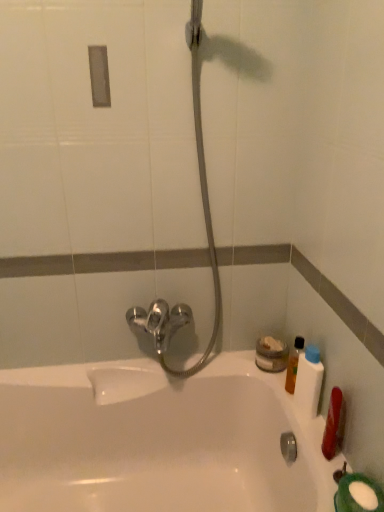
Question: Considering the relative sizes of translucent plastic bottle at right, which appears as the 1th mouthwash when viewed from the back, and white glossy bathtub at center in the image provided, is translucent plastic bottle at right, which appears as the 1th mouthwash when viewed from the back, taller than white glossy bathtub at center?

Choices:
 (A) no
 (B) yes

Answer: (A)

Question: From the image's perspective, is translucent plastic bottle at right, marked as the 2th mouthwash in a front-to-back arrangement, located beneath white glossy bathtub at center?

Choices:
 (A) no
 (B) yes

Answer: (A)

Question: From a real-world perspective, is translucent plastic bottle at right, which appears as the 1th mouthwash when viewed from the back, on white glossy bathtub at center?

Choices:
 (A) yes
 (B) no

Answer: (A)

Question: Does translucent plastic bottle at right, which appears as the 1th mouthwash when viewed from the back, lie behind white glossy bathtub at center?

Choices:
 (A) no
 (B) yes

Answer: (B)

Question: Considering the relative sizes of translucent plastic bottle at right, which appears as the 1th mouthwash when viewed from the back, and white glossy bathtub at center in the image provided, is translucent plastic bottle at right, which appears as the 1th mouthwash when viewed from the back, smaller than white glossy bathtub at center?

Choices:
 (A) no
 (B) yes

Answer: (B)

Question: Is translucent plastic bottle at right, marked as the 2th mouthwash in a front-to-back arrangement, spatially inside satin nickel faucet at center, or outside of it?

Choices:
 (A) inside
 (B) outside

Answer: (B)

Question: In terms of width, does translucent plastic bottle at right, which appears as the 1th mouthwash when viewed from the back, look wider or thinner when compared to satin nickel faucet at center?

Choices:
 (A) thin
 (B) wide

Answer: (A)

Question: Based on their sizes in the image, would you say translucent plastic bottle at right, which appears as the 1th mouthwash when viewed from the back, is bigger or smaller than satin nickel faucet at center?

Choices:
 (A) big
 (B) small

Answer: (B)

Question: In terms of height, does translucent plastic bottle at right, marked as the 2th mouthwash in a front-to-back arrangement, look taller or shorter compared to satin nickel faucet at center?

Choices:
 (A) short
 (B) tall

Answer: (A)

Question: Is satin nickel faucet at center bigger or smaller than white plastic bottle at right, the second mouthwash from the back?

Choices:
 (A) big
 (B) small

Answer: (A)

Question: From the image's perspective, is satin nickel faucet at center positioned above or below white plastic bottle at right, arranged as the 1th mouthwash when viewed from the front?

Choices:
 (A) above
 (B) below

Answer: (A)

Question: From a real-world perspective, is satin nickel faucet at center above or below white plastic bottle at right, the second mouthwash from the back?

Choices:
 (A) above
 (B) below

Answer: (A)

Question: Relative to white plastic bottle at right, arranged as the 1th mouthwash when viewed from the front, is satin nickel faucet at center in front or behind?

Choices:
 (A) behind
 (B) front

Answer: (B)

Question: Based on their positions, is white plastic bottle at right, arranged as the 1th mouthwash when viewed from the front, located to the left or right of white glossy bathtub at center?

Choices:
 (A) right
 (B) left

Answer: (A)

Question: From the image's perspective, is white plastic bottle at right, the second mouthwash from the back, above or below white glossy bathtub at center?

Choices:
 (A) above
 (B) below

Answer: (A)